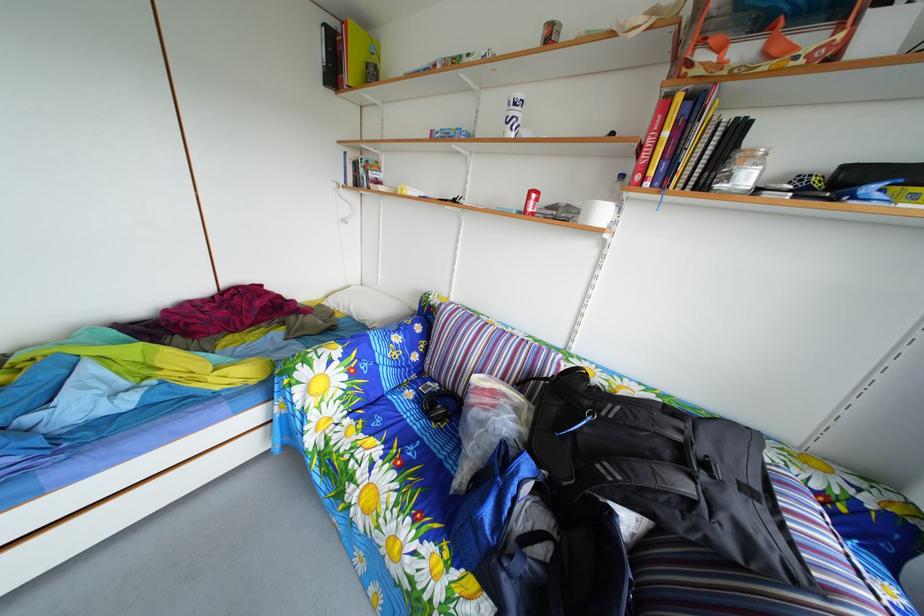
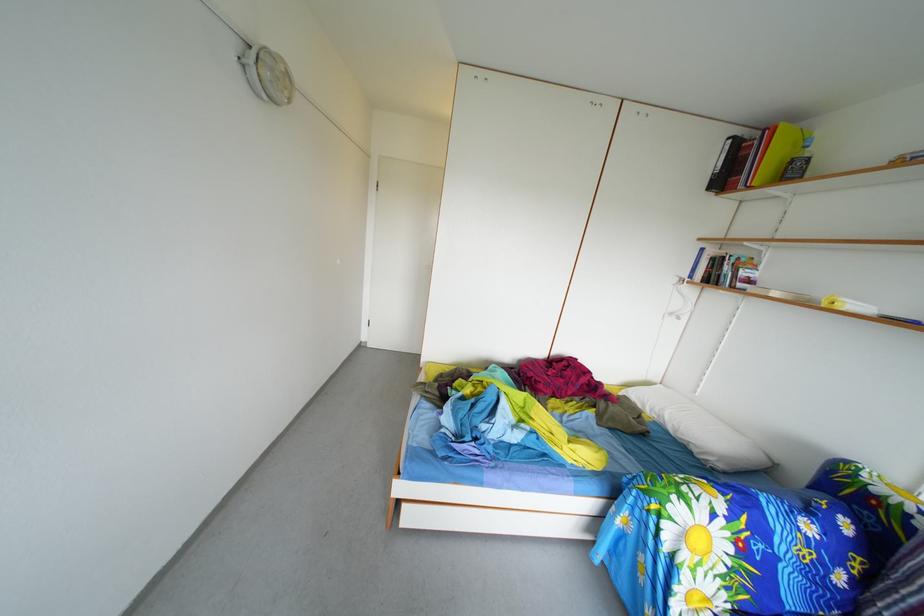
Question: The first image is from the beginning of the video and the second image is from the end. How did the camera likely rotate when shooting the video?

Choices:
 (A) Left
 (B) Right
 (C) Up
 (D) Down

Answer: (A)